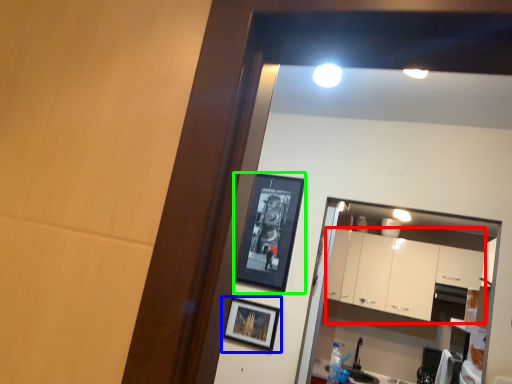
Question: Based on their relative distances, which object is nearer to cabinetry (highlighted by a red box)? Choose from picture frame (highlighted by a blue box) and picture frame (highlighted by a green box).

Choices:
 (A) picture frame
 (B) picture frame

Answer: (B)